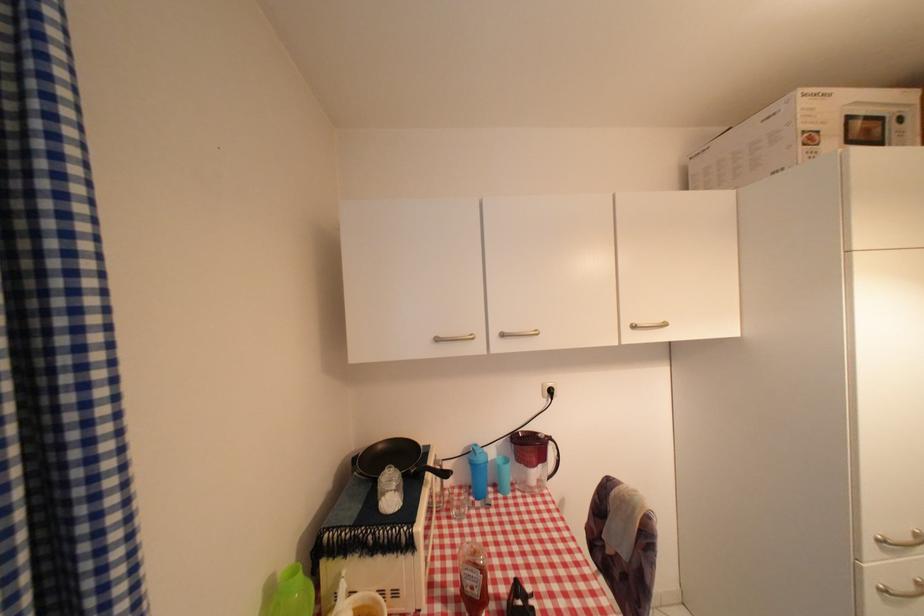
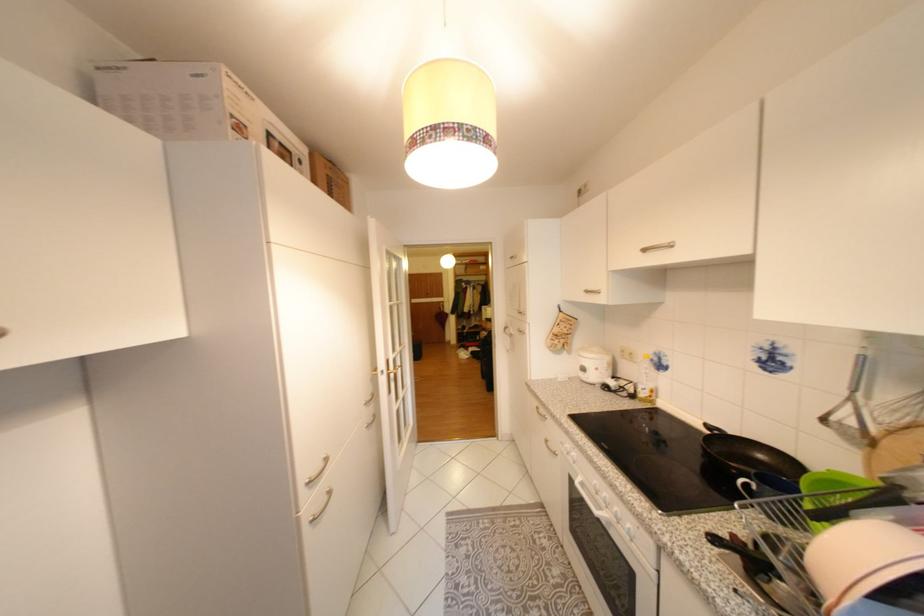
Question: The camera is either moving clockwise (left) or counter-clockwise (right) around the object. The first image is from the beginning of the video and the second image is from the end. Is the camera moving left or right when shooting the video?

Choices:
 (A) Left
 (B) Right

Answer: (A)